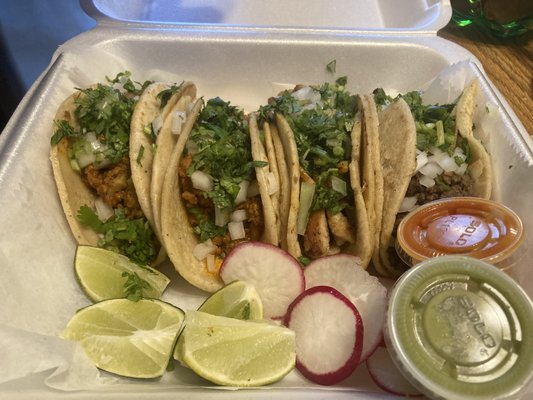
Find the location of a particular element. green glass is located at coordinates (474, 31).